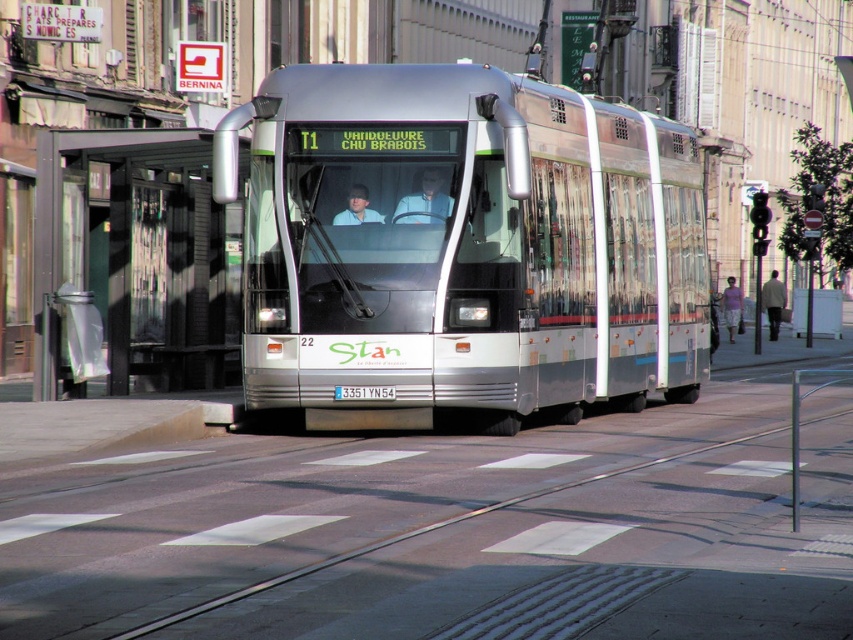
Which is below, black metal bus stop at center or light gray metallic coach at right?

black metal bus stop at center is lower down.

Is black metal bus stop at center above light gray metallic coach at right?

No.

This screenshot has width=853, height=640. Identify the location of black metal bus stop at center. (137, 257).

Identify the location of black metal bus stop at center. The height and width of the screenshot is (640, 853). (137, 257).

Between point (839, 524) and point (171, 260), which one is positioned behind?

Positioned behind is point (171, 260).

Which is below, metallic track at center or black metal bus stop at center?

metallic track at center is below.

The width and height of the screenshot is (853, 640). Describe the element at coordinates (451, 532) in the screenshot. I see `metallic track at center` at that location.

The width and height of the screenshot is (853, 640). What are the coordinates of `metallic track at center` in the screenshot? It's located at (451, 532).

Consider the image. Can you confirm if metallic track at center is bigger than light gray metallic coach at right?

Incorrect, metallic track at center is not larger than light gray metallic coach at right.

Is metallic track at center to the right of light gray metallic coach at right from the viewer's perspective?

No, metallic track at center is not to the right of light gray metallic coach at right.

Identify the location of metallic track at center. This screenshot has height=640, width=853. (451, 532).

This screenshot has height=640, width=853. Identify the location of metallic track at center. (451, 532).